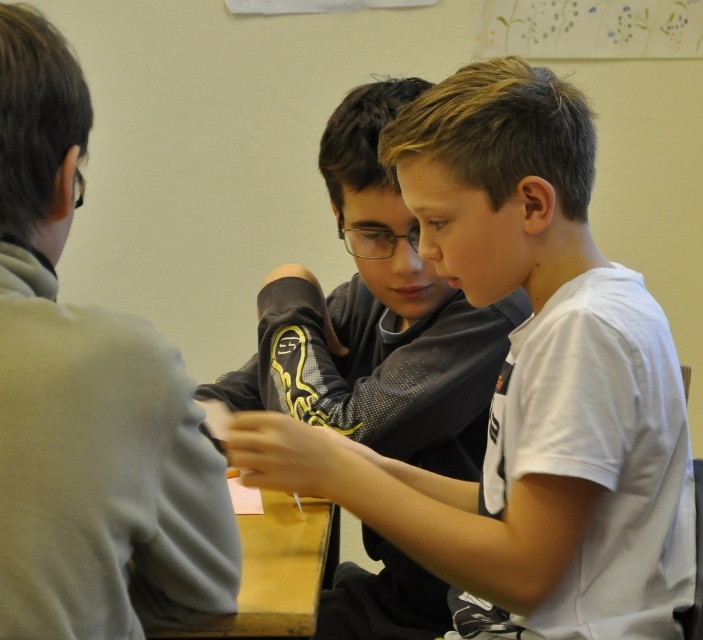
Question: Can you confirm if white matte shirt at center is thinner than light gray sweater at left?

Choices:
 (A) yes
 (B) no

Answer: (B)

Question: Which of the following is the farthest from the observer?

Choices:
 (A) (501, 568)
 (B) (278, 525)

Answer: (B)

Question: Is white matte shirt at center wider than yellow wood table at lower center?

Choices:
 (A) yes
 (B) no

Answer: (A)

Question: Does white matte shirt at center appear on the right side of light gray sweater at left?

Choices:
 (A) yes
 (B) no

Answer: (A)

Question: Which point appears closest to the camera in this image?

Choices:
 (A) (165, 632)
 (B) (128, 524)
 (C) (638, 310)

Answer: (B)

Question: Which is farther from the light gray sweater at left?

Choices:
 (A) yellow wood table at lower center
 (B) white matte shirt at center

Answer: (B)